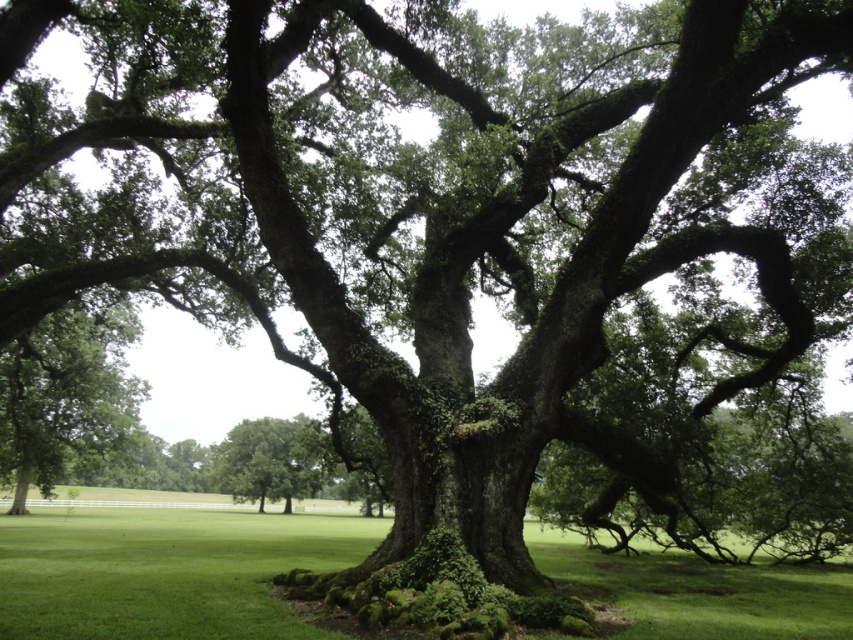
You are standing in the park and see the green mossy grass at lower center and the green mossy tree at center. Which object is located to the left of the other?

The green mossy grass at lower center is positioned on the left side of green mossy tree at center.

You are a gardener who needs to water the green mossy grass at lower center and the green mossy tree at center. If your watering can holds enough water for 5 meters of travel, can you water both without refilling?

The green mossy grass at lower center and green mossy tree at center are 7.60 meters apart. Since the watering can only holds enough water for 5 meters of travel, you cannot water both without refilling.

You are planning to place a small garden bench in the scene. The bench requires a space wider than the green mossy tree at center. Can you place it on the green mossy grass at lower center?

→ The green mossy grass at lower center is wider than the green mossy tree at center, so yes, the bench can be placed there as it provides sufficient width.